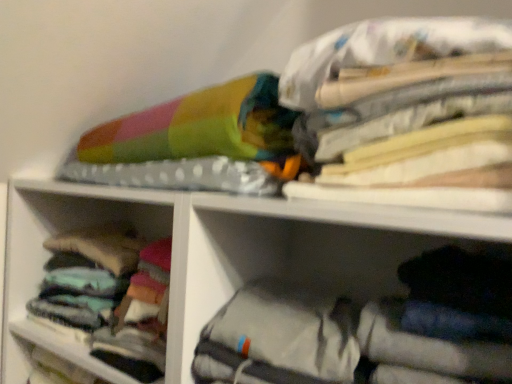
Question: Is soft cotton socks at left, arranged as the 2th cabinet when viewed from the front, spatially inside multicolored fabric at upper right, or outside of it?

Choices:
 (A) outside
 (B) inside

Answer: (A)

Question: From the image's perspective, relative to multicolored fabric at upper right, is soft cotton socks at left, the 1th cabinet viewed from the back, above or below?

Choices:
 (A) below
 (B) above

Answer: (A)

Question: Which is nearer to the gray fabric bag at lower right, the 2th cabinet when ordered from left to right?

Choices:
 (A) soft cotton socks at left, arranged as the 2th cabinet when viewed from the front
 (B) multicolored fabric at upper right

Answer: (B)

Question: Considering the real-world distances, which object is closest to the soft cotton socks at left, arranged as the 2th cabinet when viewed from the front?

Choices:
 (A) gray fabric bag at lower right, positioned as the first cabinet in front-to-back order
 (B) multicolored fabric at upper right

Answer: (A)